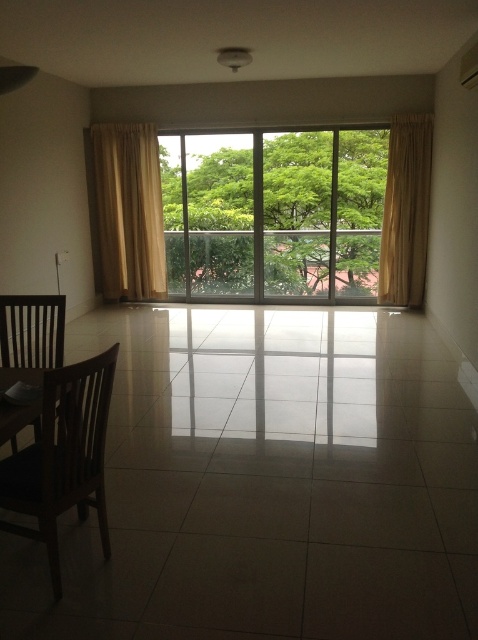
Question: Does brown wooden chair at lower left appear on the left side of beige fabric curtain at right?

Choices:
 (A) no
 (B) yes

Answer: (B)

Question: Which object is positioned closest to the beige fabric curtain at left?

Choices:
 (A) clear glass window at center
 (B) brown wooden chair at left
 (C) beige fabric curtain at right
 (D) brown wooden chair at lower left

Answer: (A)

Question: Is beige fabric curtain at left to the right of beige fabric curtain at right from the viewer's perspective?

Choices:
 (A) no
 (B) yes

Answer: (A)

Question: Which point is closer to the camera taking this photo?

Choices:
 (A) (64, 317)
 (B) (47, 420)
 (C) (401, 256)
 (D) (141, 272)

Answer: (B)

Question: Which object is the farthest from the beige fabric curtain at right?

Choices:
 (A) beige fabric curtain at left
 (B) brown wooden chair at lower left
 (C) clear glass window at center
 (D) brown wooden chair at left

Answer: (B)

Question: In this image, where is clear glass window at center located relative to brown wooden chair at left?

Choices:
 (A) below
 (B) above

Answer: (B)